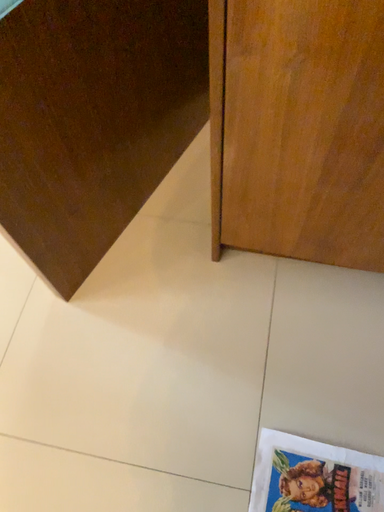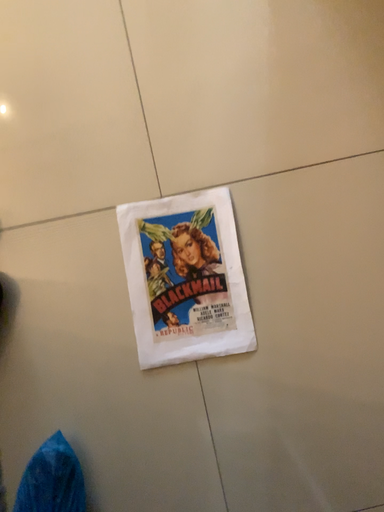
Question: Which way did the camera rotate in the video?

Choices:
 (A) rotated right
 (B) rotated left

Answer: (B)